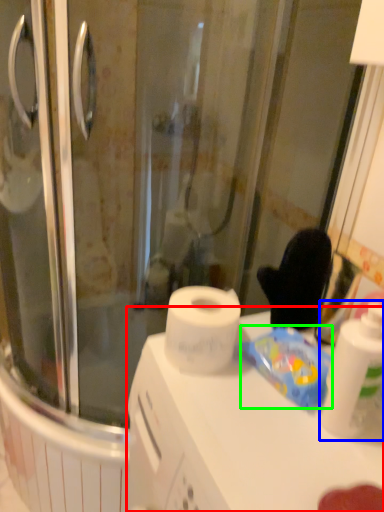
Question: Based on their relative distances, which object is farther from counter top (highlighted by a red box)? Choose from cleaning product (highlighted by a blue box) and food (highlighted by a green box).

Choices:
 (A) cleaning product
 (B) food

Answer: (A)